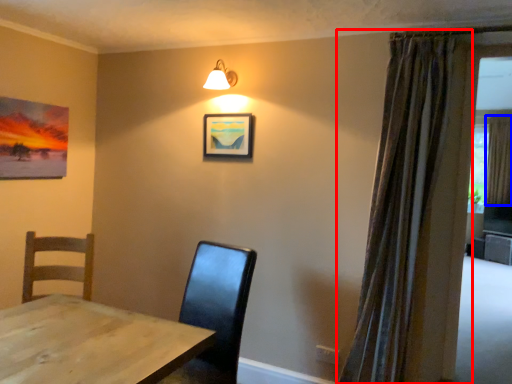
Question: Among these objects, which one is nearest to the camera, curtain (highlighted by a red box) or curtain (highlighted by a blue box)?

Choices:
 (A) curtain
 (B) curtain

Answer: (A)